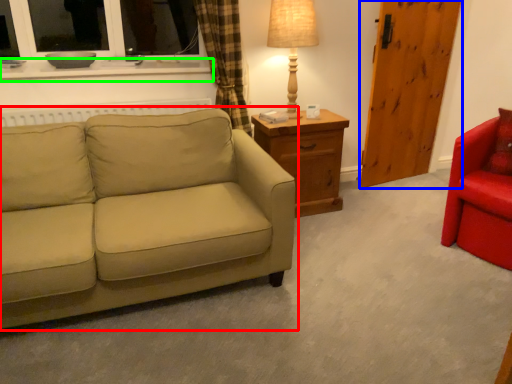
Question: Which object is positioned closest to studio couch (highlighted by a red box)? Select from barn door (highlighted by a blue box) and window sill (highlighted by a green box).

Choices:
 (A) barn door
 (B) window sill

Answer: (B)